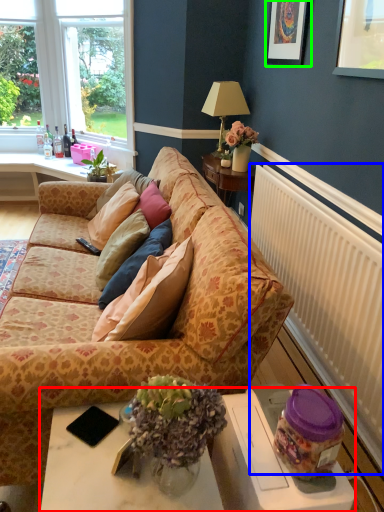
Question: Which is nearer to the table (highlighted by a red box)? radiator (highlighted by a blue box) or picture frame (highlighted by a green box).

Choices:
 (A) radiator
 (B) picture frame

Answer: (A)